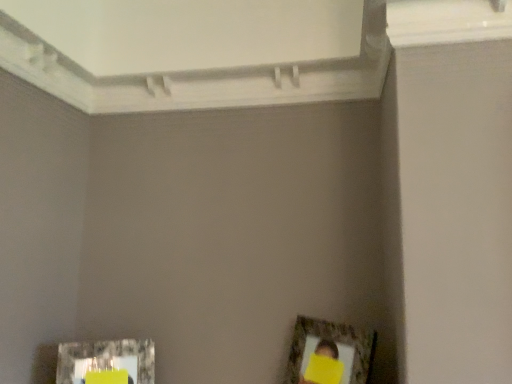
Question: Is metallic silver picture frame at lower left, which ranks as the second picture frame in right-to-left order, taller than wooden textured picture frame at lower right, placed as the second picture frame when sorted from left to right?

Choices:
 (A) no
 (B) yes

Answer: (A)

Question: Can you confirm if metallic silver picture frame at lower left, which ranks as the second picture frame in right-to-left order, is bigger than wooden textured picture frame at lower right, positioned as the 1th picture frame in right-to-left order?

Choices:
 (A) yes
 (B) no

Answer: (B)

Question: Is metallic silver picture frame at lower left, which is counted as the first picture frame, starting from the left, aimed at wooden textured picture frame at lower right, placed as the second picture frame when sorted from left to right?

Choices:
 (A) no
 (B) yes

Answer: (A)

Question: From a real-world perspective, is metallic silver picture frame at lower left, which ranks as the second picture frame in right-to-left order, on top of wooden textured picture frame at lower right, placed as the second picture frame when sorted from left to right?

Choices:
 (A) yes
 (B) no

Answer: (B)

Question: Considering the relative positions of metallic silver picture frame at lower left, which ranks as the second picture frame in right-to-left order, and wooden textured picture frame at lower right, placed as the second picture frame when sorted from left to right, in the image provided, is metallic silver picture frame at lower left, which ranks as the second picture frame in right-to-left order, behind wooden textured picture frame at lower right, placed as the second picture frame when sorted from left to right,?

Choices:
 (A) no
 (B) yes

Answer: (B)

Question: Is metallic silver picture frame at lower left, which is counted as the first picture frame, starting from the left, wider than wooden textured picture frame at lower right, placed as the second picture frame when sorted from left to right?

Choices:
 (A) no
 (B) yes

Answer: (A)

Question: Is wooden textured picture frame at lower right, positioned as the 1th picture frame in right-to-left order, positioned before metallic silver picture frame at lower left, which is counted as the first picture frame, starting from the left?

Choices:
 (A) yes
 (B) no

Answer: (A)

Question: Does wooden textured picture frame at lower right, placed as the second picture frame when sorted from left to right, appear on the left side of metallic silver picture frame at lower left, which ranks as the second picture frame in right-to-left order?

Choices:
 (A) yes
 (B) no

Answer: (B)

Question: Can metallic silver picture frame at lower left, which is counted as the first picture frame, starting from the left, be found inside wooden textured picture frame at lower right, placed as the second picture frame when sorted from left to right?

Choices:
 (A) no
 (B) yes

Answer: (A)

Question: Is wooden textured picture frame at lower right, positioned as the 1th picture frame in right-to-left order, further to the viewer compared to metallic silver picture frame at lower left, which ranks as the second picture frame in right-to-left order?

Choices:
 (A) no
 (B) yes

Answer: (A)

Question: Is wooden textured picture frame at lower right, placed as the second picture frame when sorted from left to right, located outside metallic silver picture frame at lower left, which is counted as the first picture frame, starting from the left?

Choices:
 (A) yes
 (B) no

Answer: (A)

Question: From a real-world perspective, is wooden textured picture frame at lower right, positioned as the 1th picture frame in right-to-left order, physically below metallic silver picture frame at lower left, which ranks as the second picture frame in right-to-left order?

Choices:
 (A) yes
 (B) no

Answer: (B)

Question: In terms of height, does metallic silver picture frame at lower left, which is counted as the first picture frame, starting from the left, look taller or shorter compared to wooden textured picture frame at lower right, positioned as the 1th picture frame in right-to-left order?

Choices:
 (A) tall
 (B) short

Answer: (B)